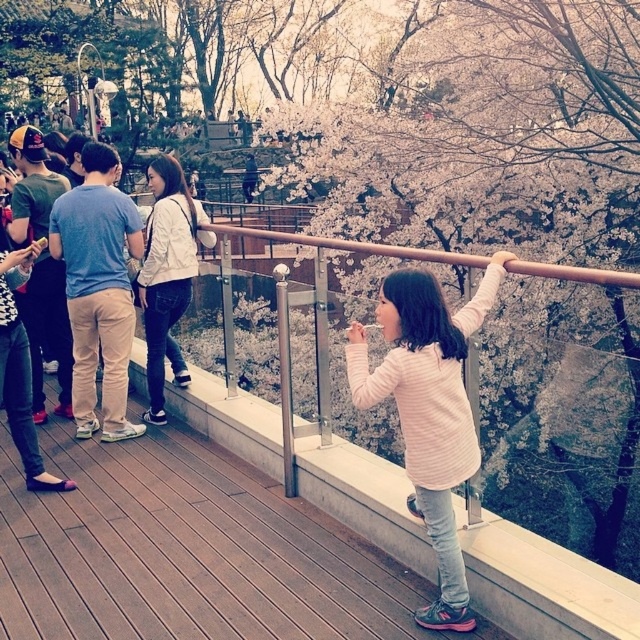
You are a photographer trying to capture a photo of the wooden at center and the pink striped shirt at center. Based on their heights, which object should you focus on first if you want to ensure both are in frame without moving the camera?

The wooden at center has a lesser height compared to pink striped shirt at center, so you should focus on the pink striped shirt at center first to ensure both are in frame.